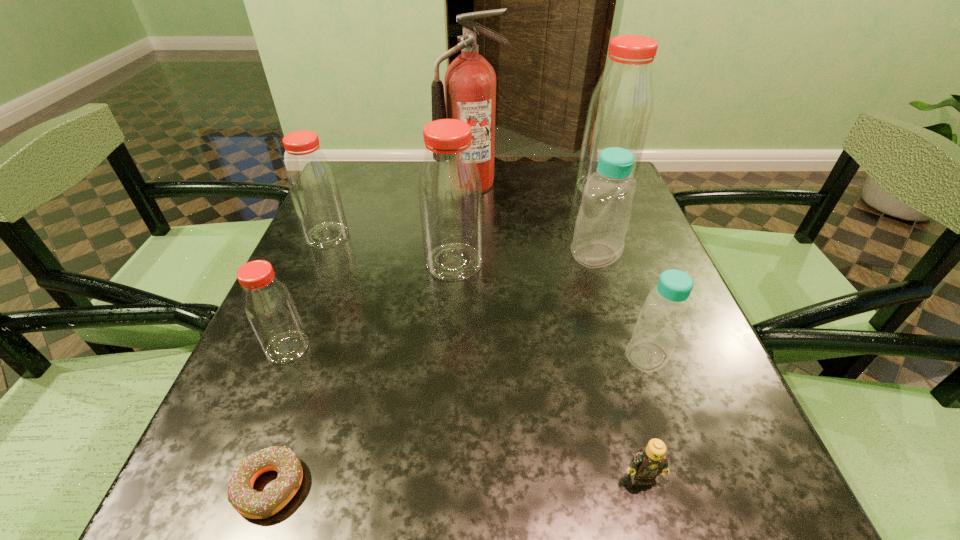
Where is `vacant space in between the biggest red bottle and the Lego`? vacant space in between the biggest red bottle and the Lego is located at coordinates (x=623, y=333).

You are a GUI agent. You are given a task and a screenshot of the screen. Output one action in this format:
    pyautogui.click(x=<x>, y=<y>)
    Task: Click on the free spot between the second shortest object and the second smallest red bottle
    This screenshot has width=960, height=540.
    Given the screenshot: What is the action you would take?
    pyautogui.click(x=484, y=356)

Identify which object is the eighth nearest to the fire extinguisher. Please provide its 2D coordinates. Your answer should be formatted as a tuple, i.e. [(x, y)], where the tuple contains the x and y coordinates of a point satisfying the conditions above.

[(650, 461)]

Select which object is the second closest to the bigger blue bottle. Please provide its 2D coordinates. Your answer should be formatted as a tuple, i.e. [(x, y)], where the tuple contains the x and y coordinates of a point satisfying the conditions above.

[(665, 310)]

The height and width of the screenshot is (540, 960). In order to click on bottle identified as the second closest to the second smallest red bottle in this screenshot , I will do `click(271, 311)`.

Point out which bottle is positioned as the sixth nearest to the chocolate doughnut. Please provide its 2D coordinates. Your answer should be formatted as a tuple, i.e. [(x, y)], where the tuple contains the x and y coordinates of a point satisfying the conditions above.

[(619, 114)]

The width and height of the screenshot is (960, 540). In order to click on red bottle that is the closest to the farthest red bottle in this screenshot , I will do `click(450, 195)`.

At what (x,y) coordinates should I click in order to perform the action: click on the third closest red bottle to the Lego. Please return your answer as a coordinate pair (x, y). This screenshot has height=540, width=960. Looking at the image, I should click on (619, 114).

Locate an element on the screen. The width and height of the screenshot is (960, 540). free space that satisfies the following two spatial constraints: 1. on the front side of the bigger blue bottle; 2. on the right side of the third biggest red bottle is located at coordinates (319, 255).

Locate an element on the screen. This screenshot has width=960, height=540. free space that satisfies the following two spatial constraints: 1. on the front of the red fire extinguisher near the operation label; 2. on the right side of the farther blue bottle is located at coordinates (469, 255).